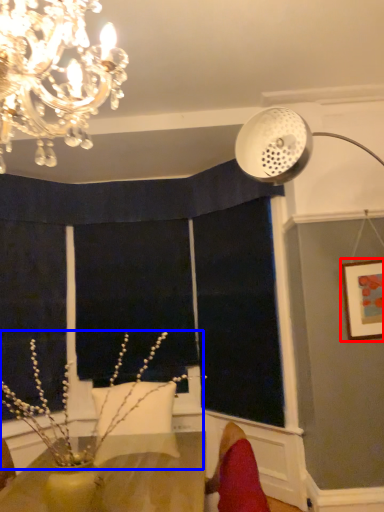
Question: Which of the following is the farthest to the observer, picture frame (highlighted by a red box) or plant (highlighted by a blue box)?

Choices:
 (A) picture frame
 (B) plant

Answer: (A)